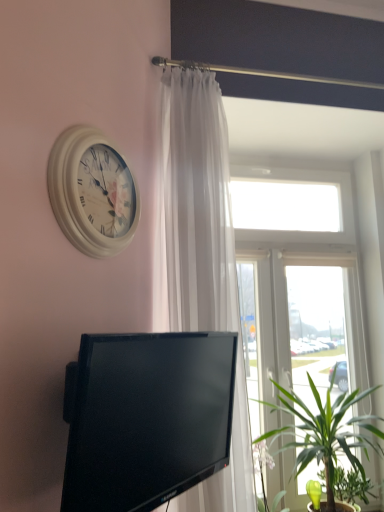
Question: Does white sheer curtain at upper center have a lesser width compared to black glossy tv at lower center?

Choices:
 (A) yes
 (B) no

Answer: (A)

Question: Is white sheer curtain at upper center smaller than black glossy tv at lower center?

Choices:
 (A) no
 (B) yes

Answer: (A)

Question: Can you confirm if white sheer curtain at upper center is bigger than black glossy tv at lower center?

Choices:
 (A) no
 (B) yes

Answer: (B)

Question: From the image's perspective, is white sheer curtain at upper center under black glossy tv at lower center?

Choices:
 (A) yes
 (B) no

Answer: (B)

Question: Is white sheer curtain at upper center to the right of black glossy tv at lower center from the viewer's perspective?

Choices:
 (A) yes
 (B) no

Answer: (A)

Question: Is white sheer curtain at upper center aimed at black glossy tv at lower center?

Choices:
 (A) yes
 (B) no

Answer: (B)

Question: Considering the relative sizes of green leafy plant at lower right and white wooden clock at upper left in the image provided, is green leafy plant at lower right taller than white wooden clock at upper left?

Choices:
 (A) yes
 (B) no

Answer: (B)

Question: Are green leafy plant at lower right and white wooden clock at upper left far apart?

Choices:
 (A) yes
 (B) no

Answer: (A)

Question: Is the depth of green leafy plant at lower right greater than that of white wooden clock at upper left?

Choices:
 (A) no
 (B) yes

Answer: (B)

Question: Does green leafy plant at lower right contain white wooden clock at upper left?

Choices:
 (A) no
 (B) yes

Answer: (A)

Question: Is green leafy plant at lower right not within white wooden clock at upper left?

Choices:
 (A) yes
 (B) no

Answer: (A)

Question: Considering the relative sizes of green leafy plant at lower right and white wooden clock at upper left in the image provided, is green leafy plant at lower right wider than white wooden clock at upper left?

Choices:
 (A) no
 (B) yes

Answer: (B)

Question: Does transparent glass window at upper center appear on the right side of green leafy plant at lower right?

Choices:
 (A) no
 (B) yes

Answer: (B)